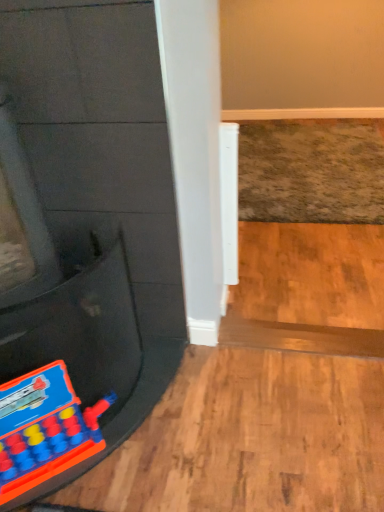
At what (x,y) coordinates should I click in order to perform the action: click on free space in front of plastic toy train at lower left. Please return your answer as a coordinate pair (x, y). The image size is (384, 512). Looking at the image, I should click on (74, 494).